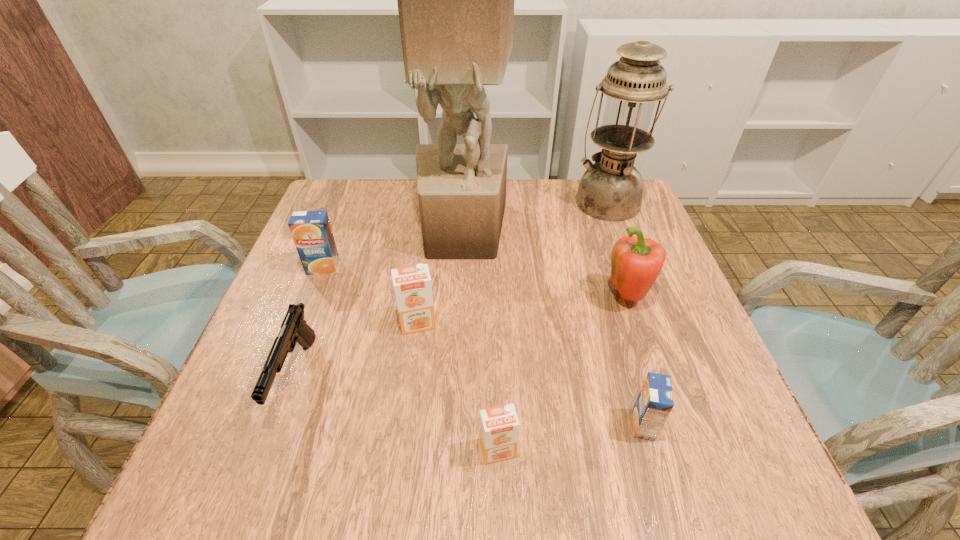
What are the coordinates of `vacant space that satisfies the following two spatial constraints: 1. on the back side of the pepper; 2. on the left side of the nearer orange orange juice` in the screenshot? It's located at (493, 298).

Image resolution: width=960 pixels, height=540 pixels. Identify the location of vacant space that satisfies the following two spatial constraints: 1. on the front-facing side of the gray sculpture; 2. on the left side of the pepper. (459, 298).

Locate an element on the screen. blank space that satisfies the following two spatial constraints: 1. at the aiming end of the gun; 2. on the right side of the nearer blue orange_juice is located at coordinates (279, 425).

Where is `free spot that satisfies the following two spatial constraints: 1. on the front-facing side of the tallest object; 2. on the right side of the second orange juice from right to left`? Image resolution: width=960 pixels, height=540 pixels. free spot that satisfies the following two spatial constraints: 1. on the front-facing side of the tallest object; 2. on the right side of the second orange juice from right to left is located at coordinates (451, 450).